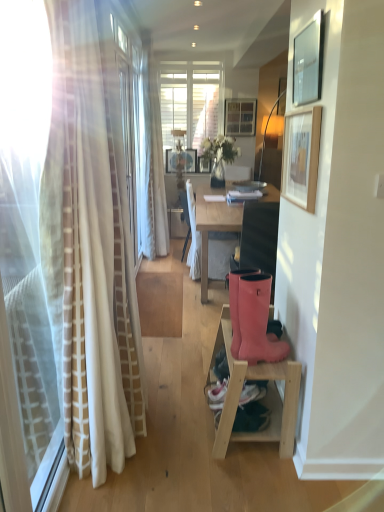
Question: From the image's perspective, is wooden picture frame at upper center, which ranks as the second picture frame in back-to-front order, under matte black picture frame at upper right, which is the second picture frame in right-to-left order?

Choices:
 (A) no
 (B) yes

Answer: (A)

Question: From a real-world perspective, is wooden picture frame at upper center, which is the 3th picture frame from front to back, positioned under matte black picture frame at upper right, placed as the 3th picture frame when sorted from top to bottom, based on gravity?

Choices:
 (A) no
 (B) yes

Answer: (B)

Question: Does wooden picture frame at upper center, which ranks as the second picture frame in back-to-front order, lie behind matte black picture frame at upper right, which appears as the 1th picture frame when viewed from the front?

Choices:
 (A) yes
 (B) no

Answer: (A)

Question: Would you say wooden picture frame at upper center, acting as the 4th picture frame starting from the bottom, is a long distance from matte black picture frame at upper right, which appears as the 1th picture frame when viewed from the front?

Choices:
 (A) yes
 (B) no

Answer: (A)

Question: Is wooden picture frame at upper center, marked as the 4th picture frame in a left-to-right arrangement, located outside matte black picture frame at upper right, the fourth picture frame positioned from the back?

Choices:
 (A) yes
 (B) no

Answer: (A)

Question: From the image's perspective, is rubber boots at lower right positioned above or below wooden picture frame at upper right, marked as the 3th picture frame in a right-to-left arrangement?

Choices:
 (A) above
 (B) below

Answer: (B)

Question: Is rubber boots at lower right inside the boundaries of wooden picture frame at upper right, which is counted as the third picture frame, starting from the back, or outside?

Choices:
 (A) outside
 (B) inside

Answer: (A)

Question: From a real-world perspective, is rubber boots at lower right above or below wooden picture frame at upper right, marked as the 3th picture frame in a right-to-left arrangement?

Choices:
 (A) above
 (B) below

Answer: (B)

Question: From their relative heights in the image, would you say rubber boots at lower right is taller or shorter than wooden picture frame at upper right, placed as the 4th picture frame when sorted from top to bottom?

Choices:
 (A) short
 (B) tall

Answer: (B)

Question: In the image, is white fabric chair at center positioned in front of or behind wooden picture frame at upper center, which is the 3th picture frame from front to back?

Choices:
 (A) front
 (B) behind

Answer: (A)

Question: Is white fabric chair at center wider or thinner than wooden picture frame at upper center, acting as the 4th picture frame starting from the bottom?

Choices:
 (A) wide
 (B) thin

Answer: (A)

Question: In terms of height, does white fabric chair at center look taller or shorter compared to wooden picture frame at upper center, the first picture frame viewed from the top?

Choices:
 (A) short
 (B) tall

Answer: (B)

Question: Would you say white fabric chair at center is inside or outside wooden picture frame at upper center, arranged as the 1th picture frame when viewed from the right?

Choices:
 (A) inside
 (B) outside

Answer: (B)

Question: From the image's perspective, is wooden picture frame at center, the third picture frame from the bottom, positioned above or below wooden picture frame at upper right, placed as the 2th picture frame when sorted from front to back?

Choices:
 (A) above
 (B) below

Answer: (A)

Question: From a real-world perspective, is wooden picture frame at center, which is the 1th picture frame in left-to-right order, above or below wooden picture frame at upper right, placed as the 2th picture frame when sorted from front to back?

Choices:
 (A) below
 (B) above

Answer: (A)